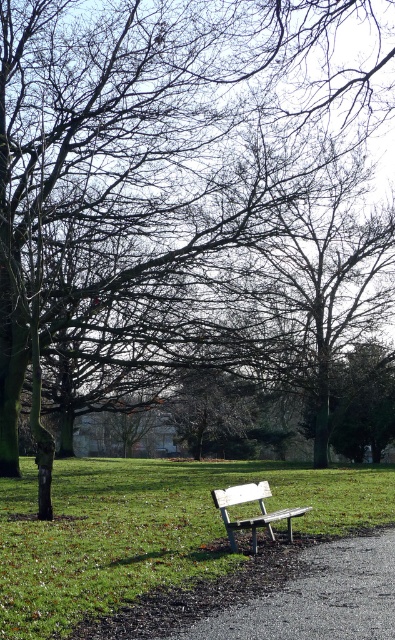
Question: Which object is farther from the camera taking this photo?

Choices:
 (A) green grass at center
 (B) gravel path at center

Answer: (A)

Question: Considering the relative positions of gravel path at center and white plastic bench at center in the image provided, where is gravel path at center located with respect to white plastic bench at center?

Choices:
 (A) left
 (B) right

Answer: (B)

Question: Which is nearer to the green grass at center?

Choices:
 (A) gravel path at center
 (B) white plastic bench at center

Answer: (B)

Question: Which of the following is the farthest from the observer?

Choices:
 (A) (263, 502)
 (B) (387, 529)

Answer: (B)

Question: Does green grass at center appear over white plastic bench at center?

Choices:
 (A) yes
 (B) no

Answer: (B)

Question: Does gravel path at center have a smaller size compared to white plastic bench at center?

Choices:
 (A) no
 (B) yes

Answer: (B)